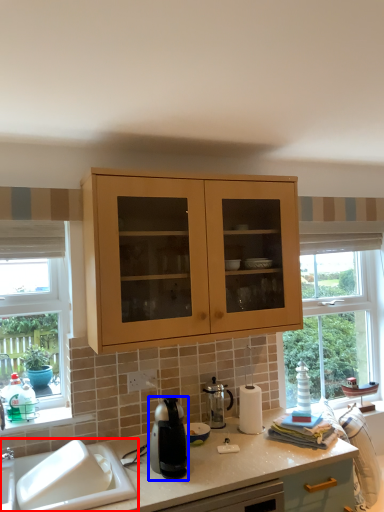
Question: Which object is closer to the camera taking this photo, sink (highlighted by a red box) or kitchen appliance (highlighted by a blue box)?

Choices:
 (A) sink
 (B) kitchen appliance

Answer: (A)